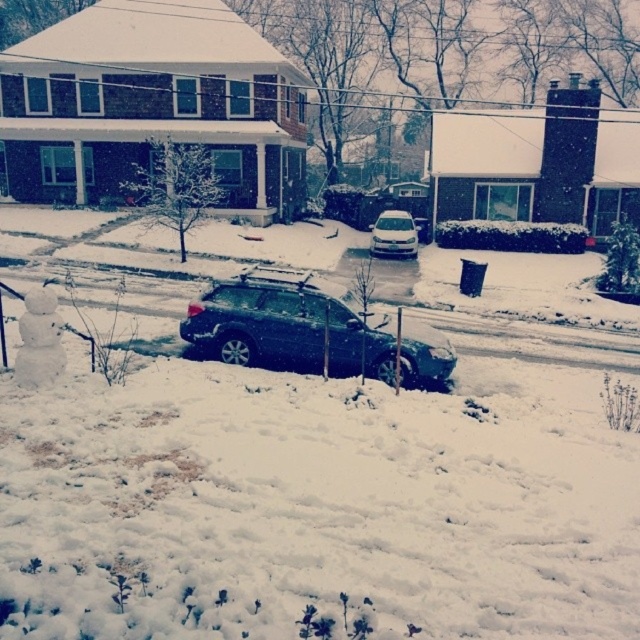
From the picture: Measure the distance between satin black suv at center and camera.

satin black suv at center is 40.60 feet from camera.

Does satin black suv at center come in front of white matte car at center?

That is True.

Find the location of `satin black suv at center`. satin black suv at center is located at coordinates (288, 323).